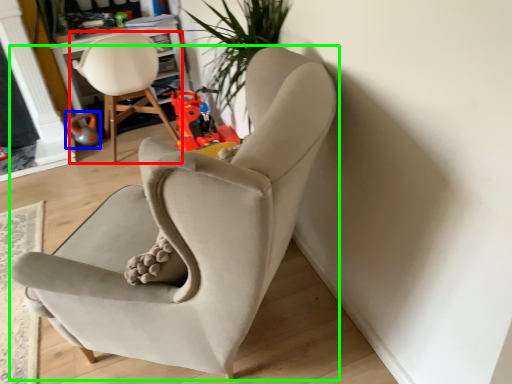
Question: Which is farther away from chair (highlighted by a red box)? toy (highlighted by a blue box) or chair (highlighted by a green box)?

Choices:
 (A) toy
 (B) chair

Answer: (B)